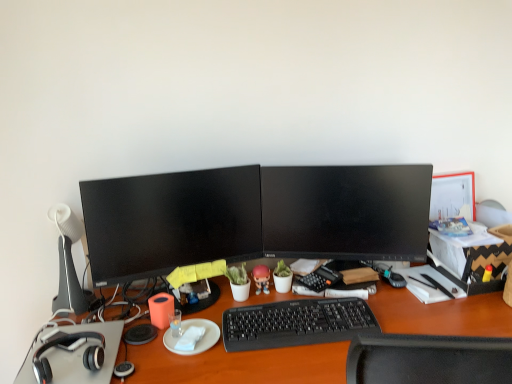
Question: Relative to black plastic keyboard at center, is white paper at center in front or behind?

Choices:
 (A) behind
 (B) front

Answer: (B)

Question: Considering the relative positions of white paper at center and black plastic keyboard at center in the image provided, is white paper at center to the left or to the right of black plastic keyboard at center?

Choices:
 (A) right
 (B) left

Answer: (B)

Question: Which object is the closest to the white plastic table lamp at left?

Choices:
 (A) black plastic keyboard at center
 (B) matte black monitor at center, which is the first computer monitor in left-to-right order
 (C) wooden desk at center
 (D) pink matte figurine at center
 (E) orange matte tissue at center

Answer: (B)

Question: Estimate the real-world distances between objects in this image. Which object is closer to the wooden desk at center?

Choices:
 (A) pink matte figurine at center
 (B) black glossy monitor at center, arranged as the 1th computer monitor when viewed from the right
 (C) black plastic keyboard at center
 (D) white plastic table lamp at left
 (E) orange matte tissue at center

Answer: (C)